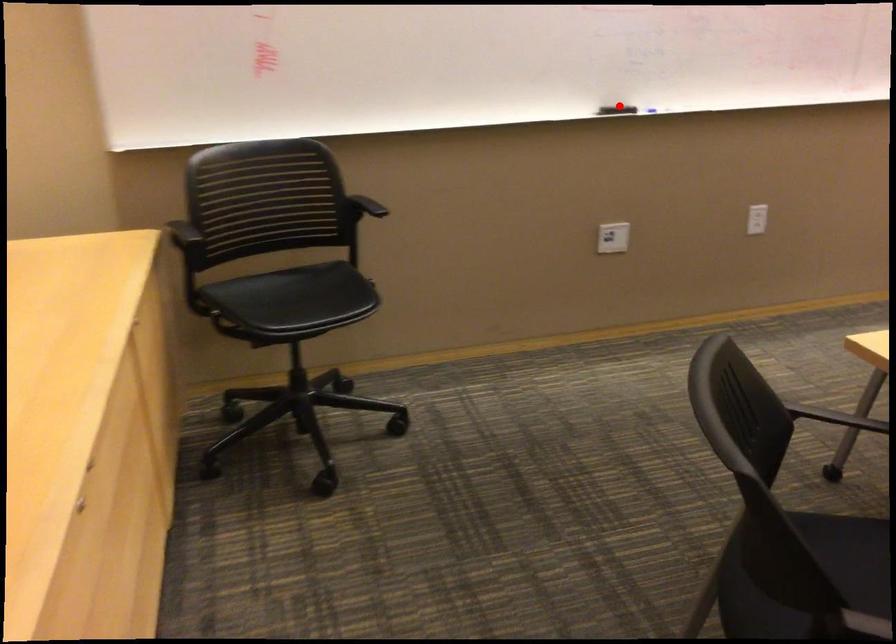
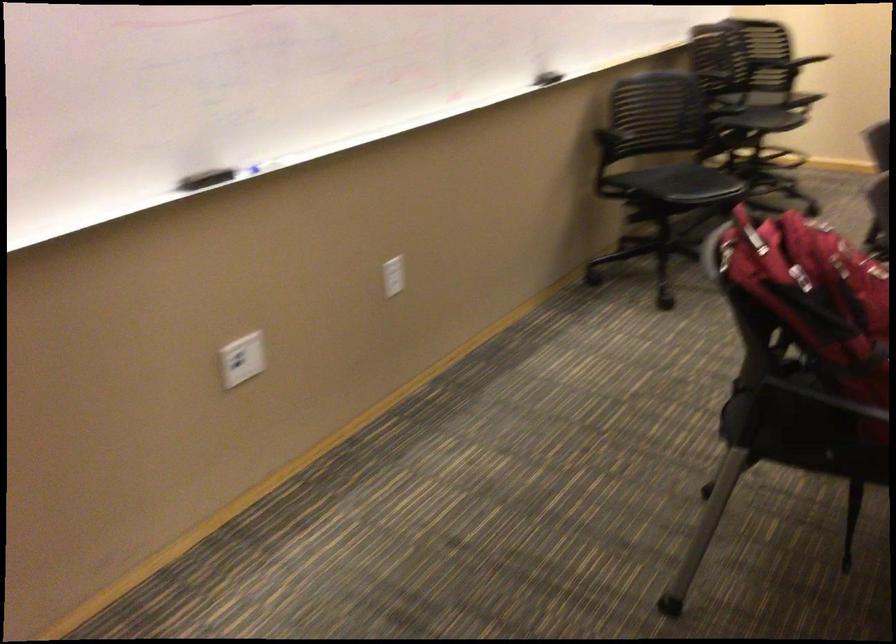
In the second image, find the point that corresponds to the highlighted location in the first image.

(204, 178)